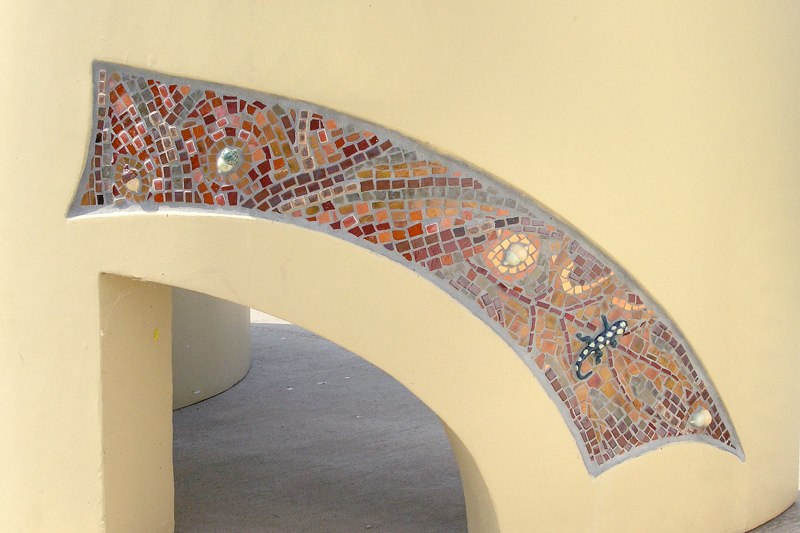
Where is `wall`? wall is located at coordinates (554, 54).